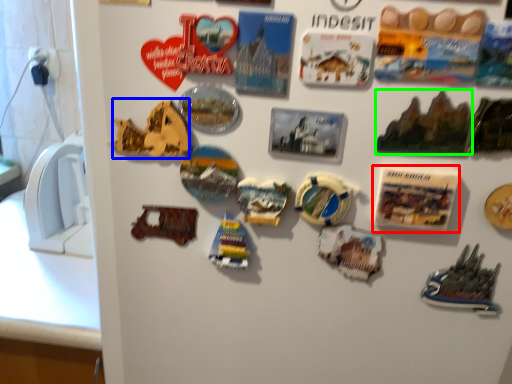
Question: Which object is positioned closest to postcard (highlighted by a red box)? Select from stuff (highlighted by a blue box) and stuff (highlighted by a green box).

Choices:
 (A) stuff
 (B) stuff

Answer: (B)